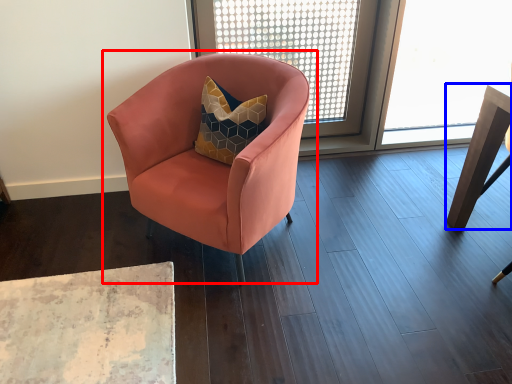
Question: Which object appears closest to the camera in this image, chair (highlighted by a red box) or table (highlighted by a blue box)?

Choices:
 (A) chair
 (B) table

Answer: (A)